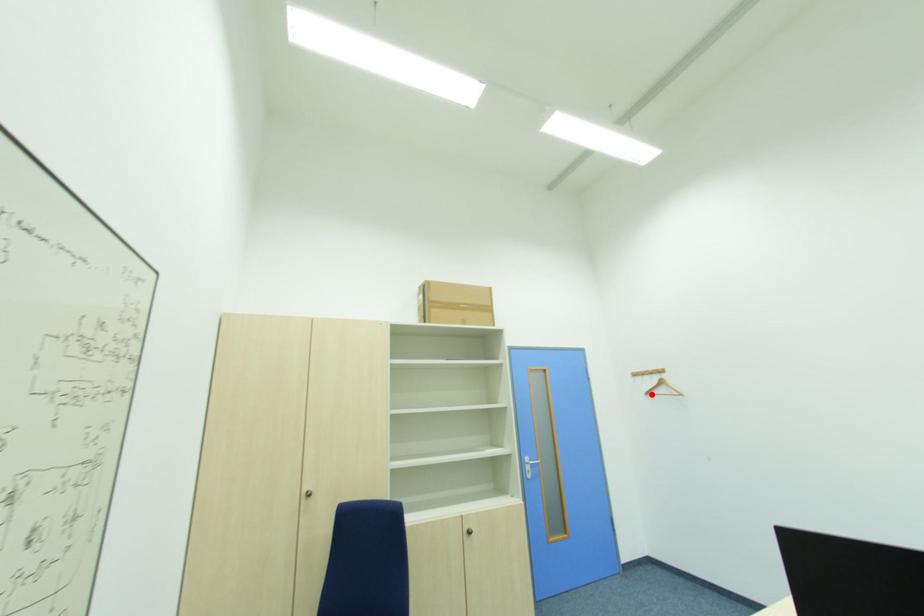
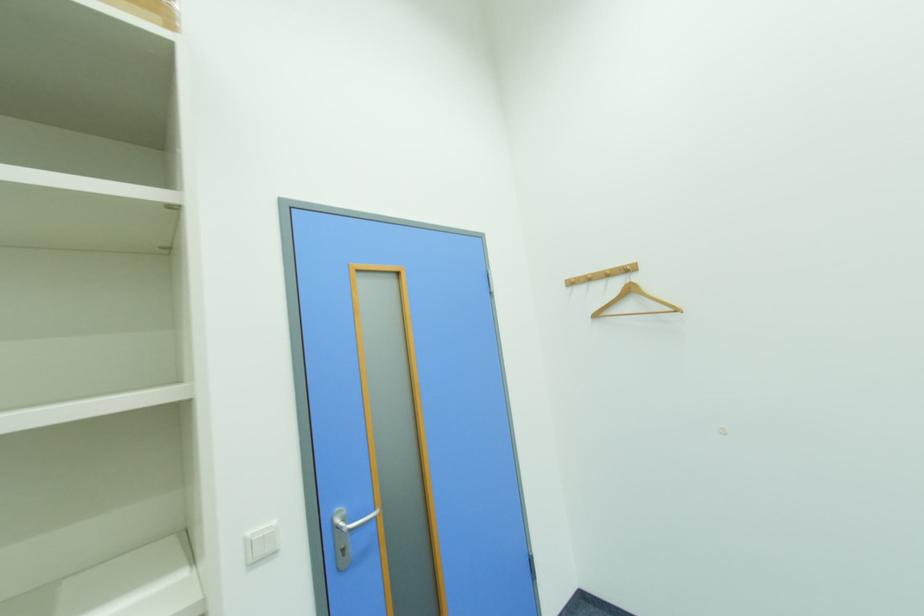
In the second image, find the point that corresponds to the highlighted location in the first image.

(601, 317)